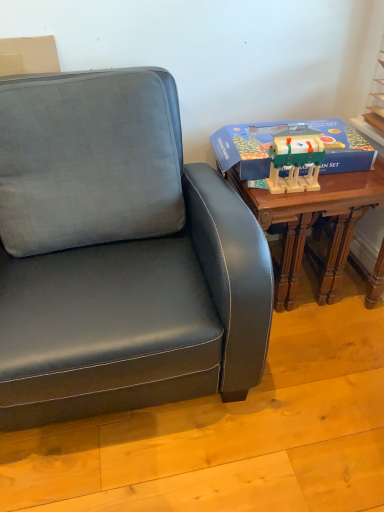
Describe the element at coordinates (287, 134) in the screenshot. I see `blue cardboard box at right` at that location.

Find the location of a particular element. The height and width of the screenshot is (512, 384). blue cardboard box at right is located at coordinates (287, 134).

Which object is closer to the camera taking this photo, wooden christmas train set at right or wooden table at right?

wooden christmas train set at right.

Is wooden christmas train set at right bigger than wooden table at right?

Actually, wooden christmas train set at right might be smaller than wooden table at right.

Is wooden table at right completely or partially inside wooden christmas train set at right?

Actually, wooden table at right is outside wooden christmas train set at right.

Could you tell me if wooden christmas train set at right is facing wooden table at right?

No, wooden christmas train set at right does not turn towards wooden table at right.

Would you say blue cardboard box at right contains wooden table at right?

Definitely not — wooden table at right is not inside blue cardboard box at right.

Who is more distant, blue cardboard box at right or wooden table at right?

blue cardboard box at right is further from the camera.

From the image's perspective, is wooden table at right above wooden christmas train set at right?

No, from the image's perspective, wooden table at right is not over wooden christmas train set at right.

Which object is further away from the camera, wooden table at right or wooden christmas train set at right?

Positioned behind is wooden table at right.

Would you say wooden table at right is outside wooden christmas train set at right?

That's correct, wooden table at right is outside of wooden christmas train set at right.

Considering the relative positions of wooden table at right and wooden christmas train set at right in the image provided, is wooden table at right to the right of wooden christmas train set at right from the viewer's perspective?

Yes.

Is point (292, 214) closer or farther from the camera than point (223, 155)?

Point (292, 214) appears to be closer to the viewer than point (223, 155).

Is blue cardboard box at right surrounded by wooden table at right?

No, blue cardboard box at right is not a part of wooden table at right.

Which object is further away from the camera, wooden table at right or blue cardboard box at right?

blue cardboard box at right is further away from the camera.

Could you tell me if wooden table at right is turned towards blue cardboard box at right?

No, wooden table at right is not facing towards blue cardboard box at right.

Image resolution: width=384 pixels, height=512 pixels. I want to click on toy on the left side of blue cardboard box at right, so click(x=295, y=163).

From a real-world perspective, is wooden christmas train set at right above or below blue cardboard box at right?

Clearly, from a real-world perspective, wooden christmas train set at right is above blue cardboard box at right.

From the image's perspective, between wooden christmas train set at right and blue cardboard box at right, which one is located above?

blue cardboard box at right, from the image's perspective.

Which object is closer to the camera, blue cardboard box at right or wooden christmas train set at right?

Positioned in front is wooden christmas train set at right.

Is blue cardboard box at right taller or shorter than wooden christmas train set at right?

Considering their sizes, blue cardboard box at right has less height than wooden christmas train set at right.

Between blue cardboard box at right and wooden christmas train set at right, which one has smaller size?

wooden christmas train set at right.

Considering the relative positions of blue cardboard box at right and wooden christmas train set at right in the image provided, is blue cardboard box at right to the left or to the right of wooden christmas train set at right?

blue cardboard box at right is positioned on wooden christmas train set at right's right side.

Where is `table behind the wooden christmas train set at right`? The width and height of the screenshot is (384, 512). table behind the wooden christmas train set at right is located at coordinates pyautogui.click(x=312, y=222).

Identify the location of table on the right of blue cardboard box at right. This screenshot has width=384, height=512. (312, 222).

From the image, which object appears to be nearer to blue cardboard box at right, wooden christmas train set at right or wooden table at right?

The object closer to blue cardboard box at right is wooden christmas train set at right.

When comparing their distances from blue cardboard box at right, does wooden table at right or wooden christmas train set at right seem closer?

The object closer to blue cardboard box at right is wooden christmas train set at right.

From the image, which object appears to be farther from wooden table at right, blue cardboard box at right or wooden christmas train set at right?

wooden christmas train set at right is further to wooden table at right.

Which object lies further to the anchor point wooden christmas train set at right, wooden table at right or blue cardboard box at right?

wooden table at right lies further to wooden christmas train set at right than the other object.

Estimate the real-world distances between objects in this image. Which object is closer to wooden table at right, wooden christmas train set at right or blue cardboard box at right?

The object closer to wooden table at right is blue cardboard box at right.

Estimate the real-world distances between objects in this image. Which object is further from wooden christmas train set at right, blue cardboard box at right or wooden table at right?

Among the two, wooden table at right is located further to wooden christmas train set at right.

Find the location of `toy between blue cardboard box at right and wooden table at right vertically`. toy between blue cardboard box at right and wooden table at right vertically is located at coordinates (295, 163).